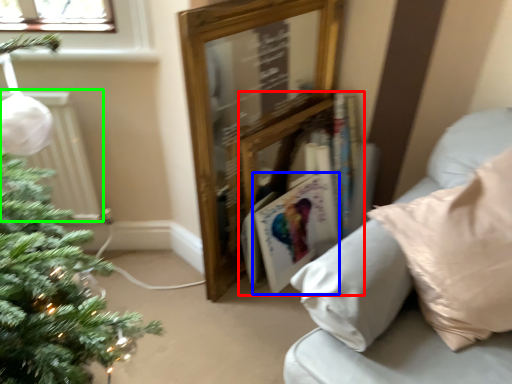
Question: Which object is positioned farthest from book (highlighted by a red box)? Select from magazine (highlighted by a blue box) and radiator (highlighted by a green box).

Choices:
 (A) magazine
 (B) radiator

Answer: (B)